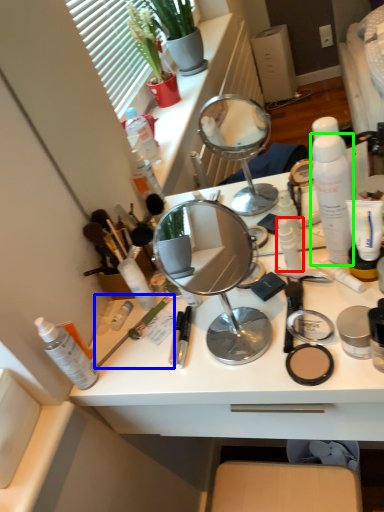
Question: Based on their relative distances, which object is farther from toiletry (highlighted by a red box)? Choose from brush (highlighted by a blue box) and toiletry (highlighted by a green box).

Choices:
 (A) brush
 (B) toiletry

Answer: (A)